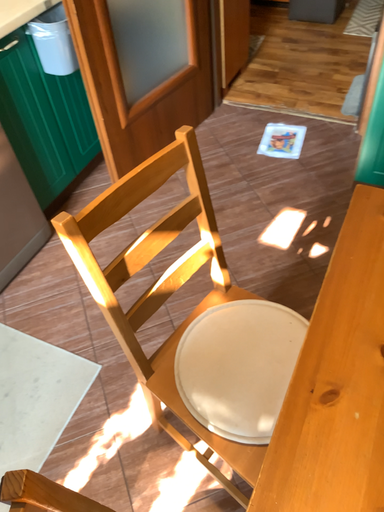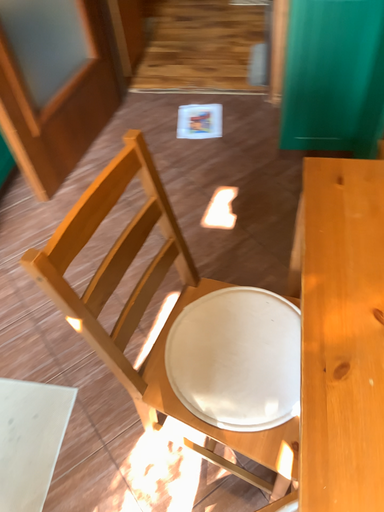
Question: How did the camera likely rotate when shooting the video?

Choices:
 (A) rotated right
 (B) rotated left

Answer: (A)